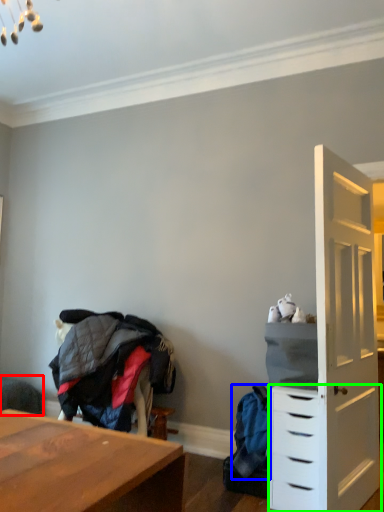
Question: Based on their relative distances, which object is nearer to swivel chair (highlighted by a red box)? Choose from clothing (highlighted by a blue box) and chest of drawers (highlighted by a green box).

Choices:
 (A) clothing
 (B) chest of drawers

Answer: (A)